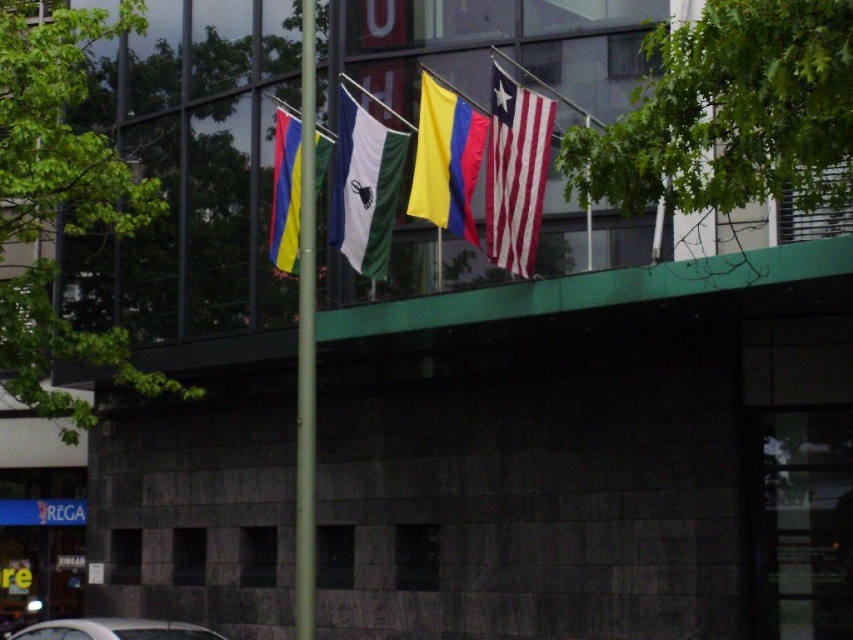
Who is positioned more to the left, multicolored fabric flag at center or silver metallic car at lower left?

silver metallic car at lower left

Is point (291, 227) less distant than point (83, 628)?

No, it is not.

This screenshot has height=640, width=853. What are the coordinates of `multicolored fabric flag at center` in the screenshot? It's located at (285, 193).

Who is higher up, metallic pole at center or white matte flag at center?

white matte flag at center

Which is more to the left, metallic pole at center or white matte flag at center?

Positioned to the left is metallic pole at center.

Who is more forward, (x=302, y=323) or (x=363, y=170)?

Positioned in front is point (x=302, y=323).

Find the location of a particular element. metallic pole at center is located at coordinates (306, 346).

Does white striped flag at upper right have a smaller size compared to multicolored fabric flag at center?

Correct, white striped flag at upper right occupies less space than multicolored fabric flag at center.

You are a GUI agent. You are given a task and a screenshot of the screen. Output one action in this format:
    pyautogui.click(x=<x>, y=<y>)
    Task: Click on the white striped flag at upper right
    This screenshot has height=640, width=853.
    Given the screenshot: What is the action you would take?
    click(x=515, y=172)

This screenshot has height=640, width=853. Find the location of `white striped flag at upper right`. white striped flag at upper right is located at coordinates (515, 172).